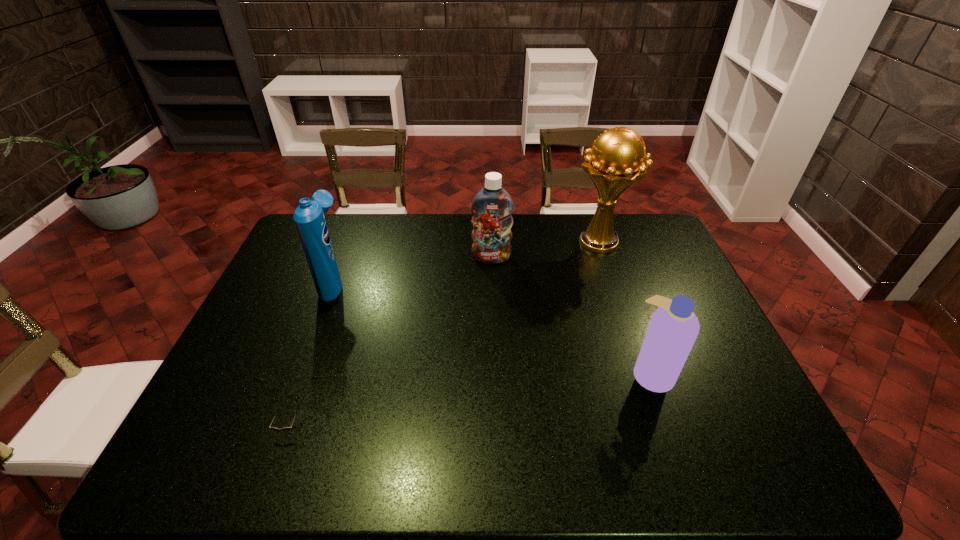
The height and width of the screenshot is (540, 960). In order to click on vacant space located on the right of the fourth farthest object in this screenshot , I will do (707, 373).

Image resolution: width=960 pixels, height=540 pixels. Find the location of `free region located 0.080m in front of the lenses of the sunglasses`. free region located 0.080m in front of the lenses of the sunglasses is located at coordinates (273, 475).

Identify the location of trophy_cup that is at the far edge. The image size is (960, 540). (615, 162).

The width and height of the screenshot is (960, 540). Identify the location of shampoo at the far edge. (492, 207).

The width and height of the screenshot is (960, 540). In order to click on object that is at the near edge in this screenshot , I will do `click(286, 429)`.

Where is `object that is at the right edge`? object that is at the right edge is located at coordinates (615, 162).

Identify the location of object that is at the far right corner. (615, 162).

In the image, there is a desktop. At what (x,y) coordinates should I click in order to perform the action: click on free space at the far edge. Please return your answer as a coordinate pair (x, y). Looking at the image, I should click on (404, 217).

This screenshot has height=540, width=960. Find the location of `vacant space at the near edge`. vacant space at the near edge is located at coordinates (568, 464).

Where is `free space at the left edge`? free space at the left edge is located at coordinates (287, 306).